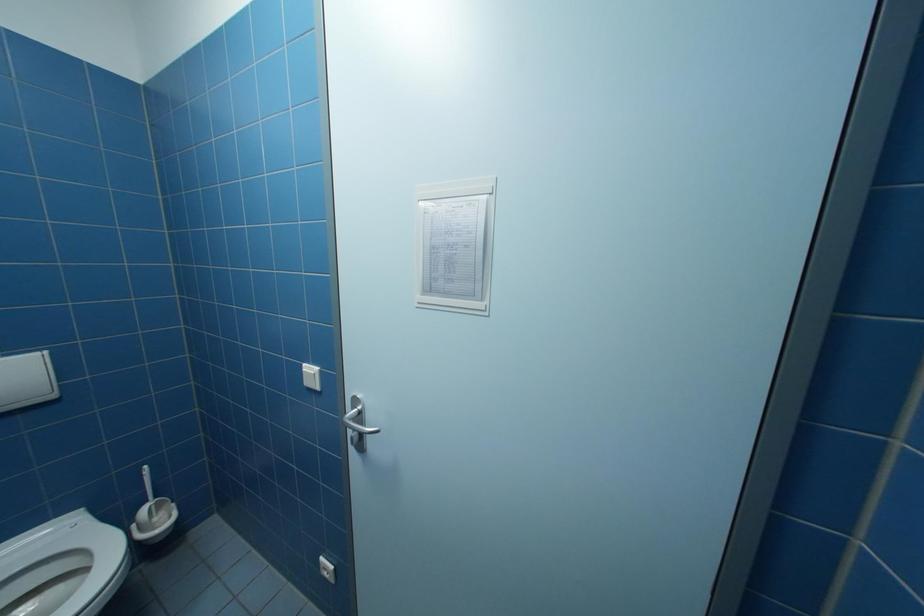
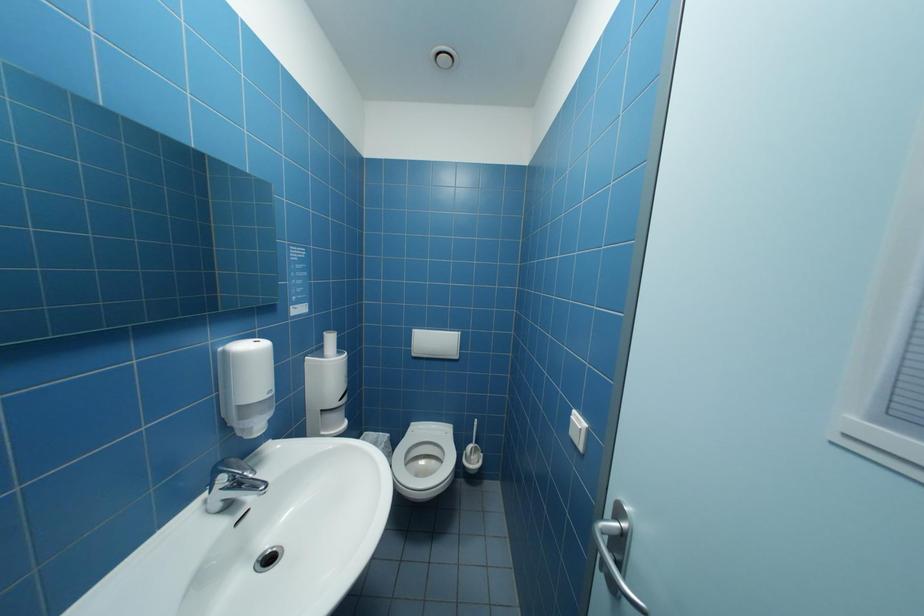
Question: Based on the continuous images, in which direction is the camera rotating? Reply with the corresponding letter.

Choices:
 (A) Left
 (B) Right
 (C) Up
 (D) Down

Answer: (A)